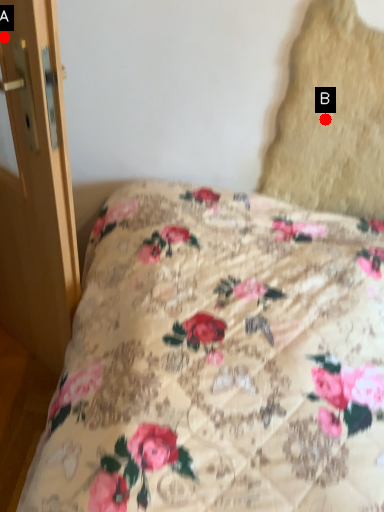
Question: Two points are circled on the image, labeled by A and B beside each circle. Which point appears closest to the camera in this image?

Choices:
 (A) A is closer
 (B) B is closer

Answer: (A)